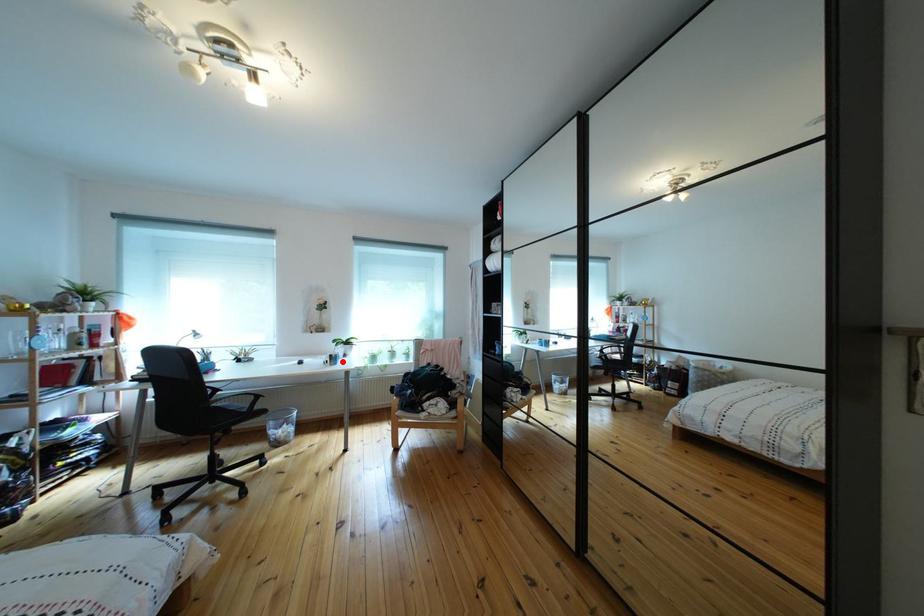
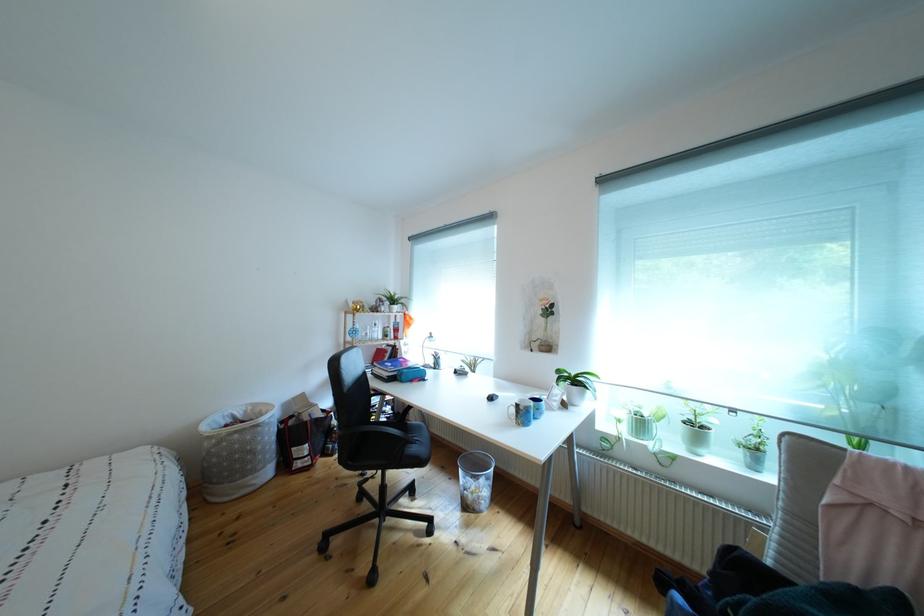
Question: I am providing you with two images of the same scene from different viewpoints. Image1 has a red point marked. In image2, the corresponding 3D location appears at what relative position? Reply with the corresponding letter.

Choices:
 (A) Closer
 (B) Farther

Answer: (B)